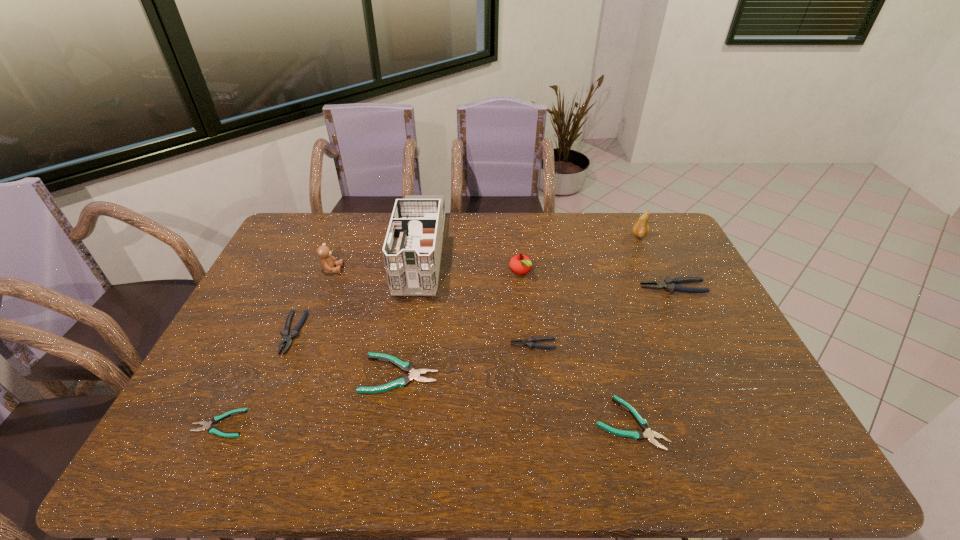
Identify the location of dollhouse. (412, 249).

I want to click on pear, so click(x=640, y=229).

This screenshot has height=540, width=960. I want to click on teddy bear, so click(328, 263).

The width and height of the screenshot is (960, 540). Identify the location of red apple. (520, 264).

Identify the location of the fourth tallest object. (520, 264).

Locate an element on the screen. the farthest pliers is located at coordinates (669, 284).

Identify the location of the rightmost pliers. (669, 284).

Find the location of a particular element. Image resolution: width=960 pixels, height=540 pixels. the leftmost gray pliers is located at coordinates (288, 335).

Locate an element on the screen. the fifth shortest pliers is located at coordinates (x=288, y=335).

Locate an element on the screen. the third pliers from right to left is located at coordinates (529, 342).